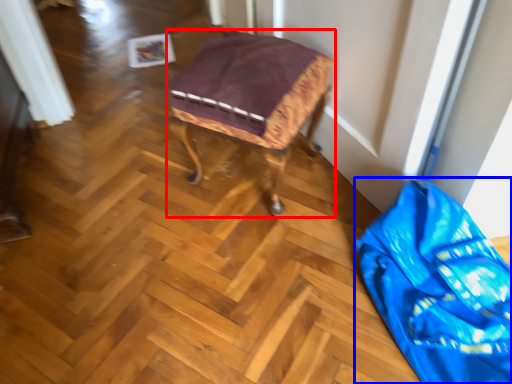
Question: Which point is closer to the camera, furniture (highlighted by a red box) or material (highlighted by a blue box)?

Choices:
 (A) furniture
 (B) material

Answer: (B)